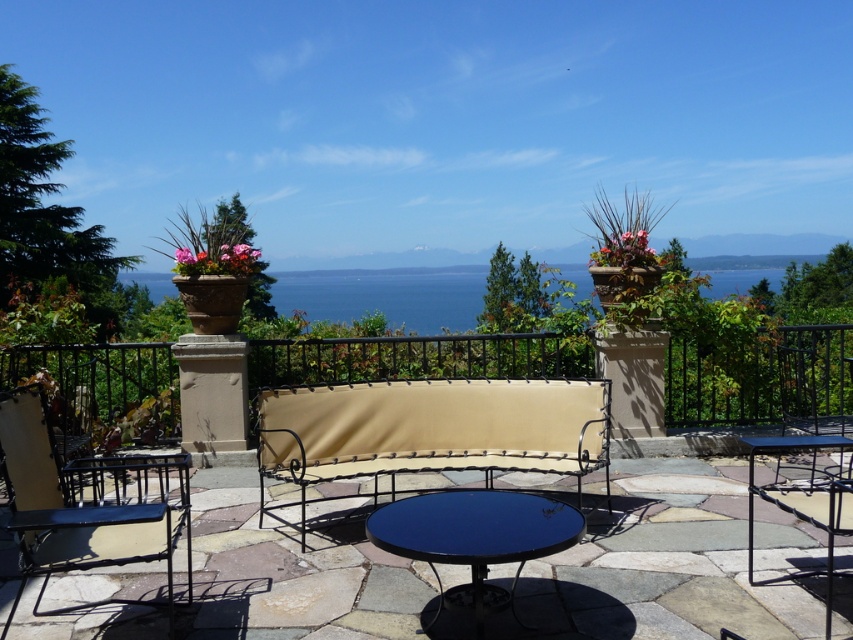
Question: Is metallic black chair at lower left smaller than metallic silver chair at center?

Choices:
 (A) no
 (B) yes

Answer: (A)

Question: Estimate the real-world distances between objects in this image. Which object is farther from the metallic black chair at right?

Choices:
 (A) metallic black chair at lower left
 (B) metallic wrought iron bench at center

Answer: (A)

Question: Which object is farther from the camera taking this photo?

Choices:
 (A) metallic black chair at right
 (B) metallic wrought iron bench at center
 (C) metallic silver chair at center
 (D) metallic black chair at lower left

Answer: (B)

Question: Does metallic black chair at lower left lie in front of metallic black chair at right?

Choices:
 (A) yes
 (B) no

Answer: (A)

Question: Which object appears farthest from the camera in this image?

Choices:
 (A) metallic wrought iron bench at center
 (B) metallic silver chair at center
 (C) metallic black chair at lower left
 (D) metallic black chair at right

Answer: (A)

Question: Is metallic black chair at lower left positioned behind blue water at center?

Choices:
 (A) no
 (B) yes

Answer: (A)